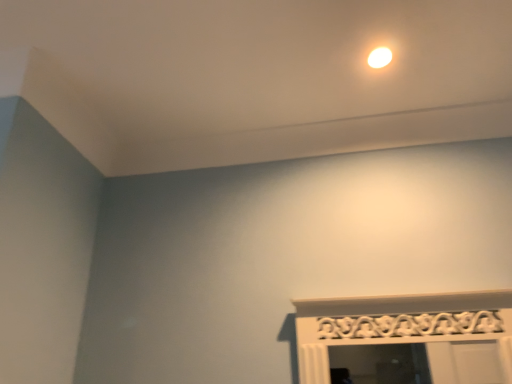
Locate an element on the screen. This screenshot has width=512, height=384. white glossy light fixture at upper center is located at coordinates coord(379,57).

Describe the element at coordinates (379, 57) in the screenshot. The width and height of the screenshot is (512, 384). I see `white glossy light fixture at upper center` at that location.

Measure the distance between point (380, 51) and camera.

3.84 feet.

You are a GUI agent. You are given a task and a screenshot of the screen. Output one action in this format:
    pyautogui.click(x=<x>, y=<y>)
    Task: Click on the white glossy light fixture at upper center
    The height and width of the screenshot is (384, 512).
    Given the screenshot: What is the action you would take?
    pyautogui.click(x=379, y=57)